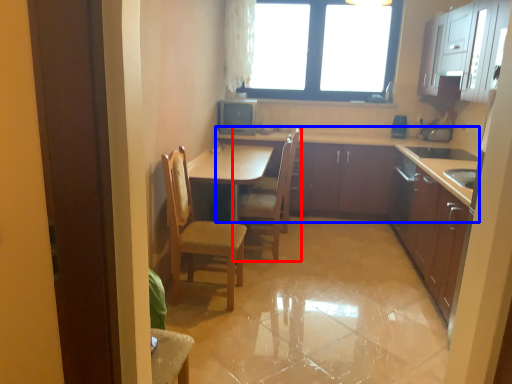
Question: Which object is closer to the camera taking this photo, chair (highlighted by a red box) or cabinetry (highlighted by a blue box)?

Choices:
 (A) chair
 (B) cabinetry

Answer: (A)